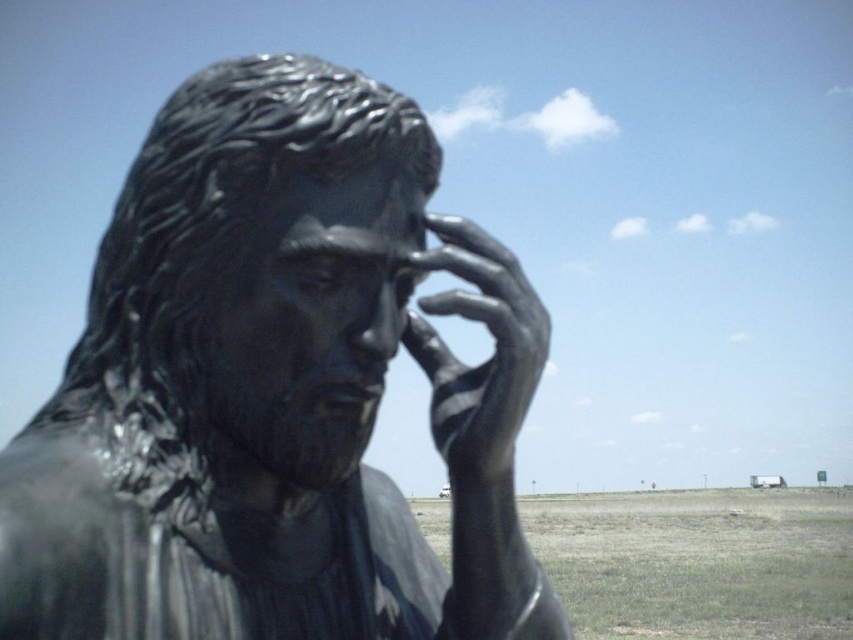
You are an art conservator assessing the statue. You notice the shiny metallic hand at center is part of the shiny bronze statue at center. Does the statue have a hand that is smaller than the statue itself?

Yes, the shiny bronze statue at center is larger in size than the shiny metallic hand at center, so the hand is indeed smaller than the statue itself.

You are an art conservator examining the statue and its hand. Based on the scene, can you determine the spatial relationship between the shiny bronze statue at center and the shiny metallic hand at center?

The shiny bronze statue at center is positioned on the left side of the shiny metallic hand at center, meaning the statue is to the left of the hand in the image.